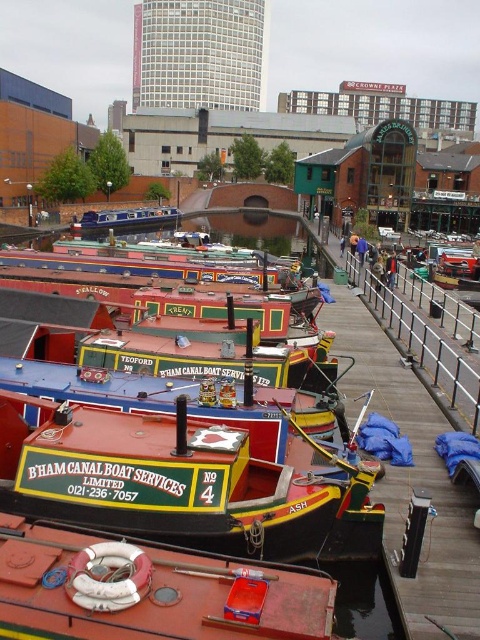
Question: Is rustic wood boat at lower center smaller than matte blue boat at center?

Choices:
 (A) no
 (B) yes

Answer: (B)

Question: Which object is farther from the camera taking this photo?

Choices:
 (A) rustic wood boat at lower center
 (B) matte blue boat at center

Answer: (B)

Question: Is rustic wood boat at lower center wider than matte blue boat at center?

Choices:
 (A) yes
 (B) no

Answer: (B)

Question: Can you confirm if rustic wood boat at lower center is positioned to the left of matte blue boat at center?

Choices:
 (A) no
 (B) yes

Answer: (A)